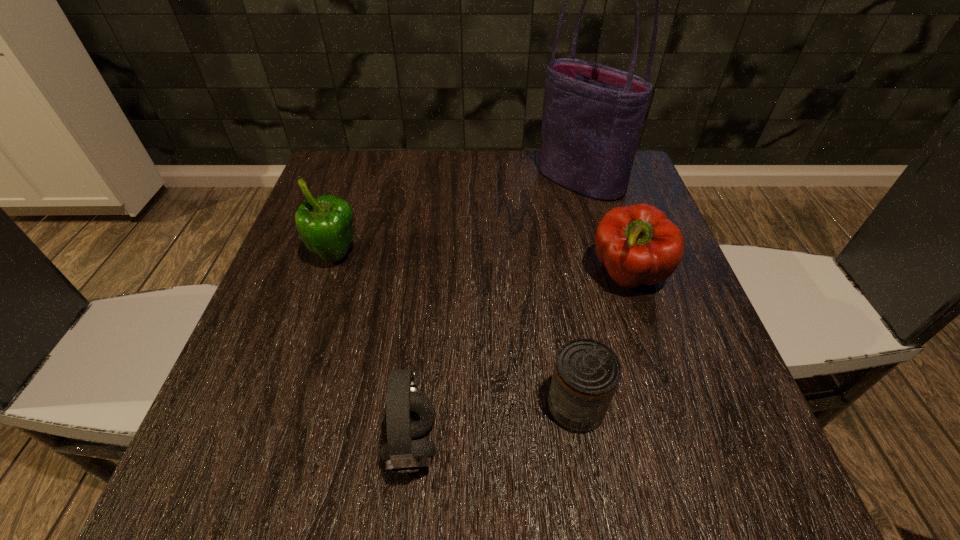
Image resolution: width=960 pixels, height=540 pixels. I want to click on free space at the right edge, so click(x=612, y=288).

This screenshot has width=960, height=540. In order to click on vacant area at the far left corner in this screenshot , I will do `click(349, 176)`.

Locate an element on the screen. The image size is (960, 540). blank space at the near left corner is located at coordinates (285, 445).

In the image, there is a desktop. Where is `free region at the far right corner`? free region at the far right corner is located at coordinates (588, 197).

In the image, there is a desktop. Where is `vacant region at the near right corner`? vacant region at the near right corner is located at coordinates (678, 485).

At what (x,y) coordinates should I click in order to perform the action: click on free space between the left bell pepper and the can. Please return your answer as a coordinate pair (x, y). The image size is (960, 540). Looking at the image, I should click on (456, 332).

Where is `vacant region between the fourth object from right to left and the farthest object`? vacant region between the fourth object from right to left and the farthest object is located at coordinates (495, 313).

Locate an element on the screen. The width and height of the screenshot is (960, 540). free space between the shortest object and the right bell pepper is located at coordinates (602, 341).

At what (x,y) coordinates should I click in order to perform the action: click on blank region between the fourth object from right to left and the leftmost object. Please return your answer as a coordinate pair (x, y). Looking at the image, I should click on (373, 350).

Locate an element on the screen. vacant space in between the leftmost object and the can is located at coordinates (456, 332).